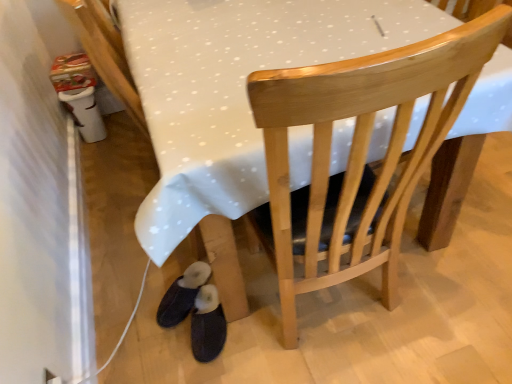
Question: From the image's perspective, is dark blue fabric slippers at lower left, marked as the 2th footwear in a left-to-right arrangement, positioned above or below black suede slippers at lower left, positioned as the first footwear in left-to-right order?

Choices:
 (A) above
 (B) below

Answer: (B)

Question: Considering the relative positions of dark blue fabric slippers at lower left, marked as the 2th footwear in a left-to-right arrangement, and black suede slippers at lower left, which appears as the 2th footwear when viewed from the right, in the image provided, is dark blue fabric slippers at lower left, marked as the 2th footwear in a left-to-right arrangement, to the left or to the right of black suede slippers at lower left, which appears as the 2th footwear when viewed from the right,?

Choices:
 (A) right
 (B) left

Answer: (A)

Question: Which object is positioned farthest from the black suede slippers at lower left, positioned as the first footwear in left-to-right order?

Choices:
 (A) dark blue fabric slippers at lower left, marked as the 2th footwear in a left-to-right arrangement
 (B) wooden chair at center

Answer: (B)

Question: Estimate the real-world distances between objects in this image. Which object is closer to the black suede slippers at lower left, which appears as the 2th footwear when viewed from the right?

Choices:
 (A) dark blue fabric slippers at lower left, marked as the 2th footwear in a left-to-right arrangement
 (B) wooden chair at center

Answer: (A)